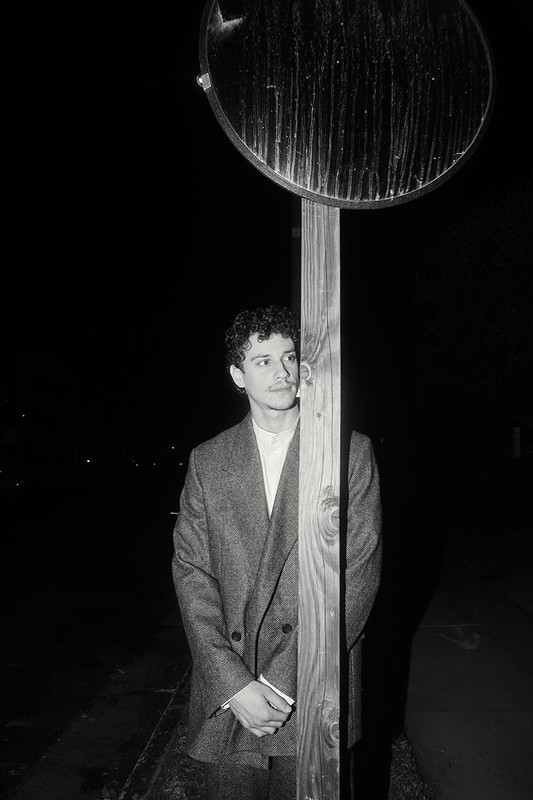
In order to click on wood post in this screenshot , I will do `click(317, 386)`.